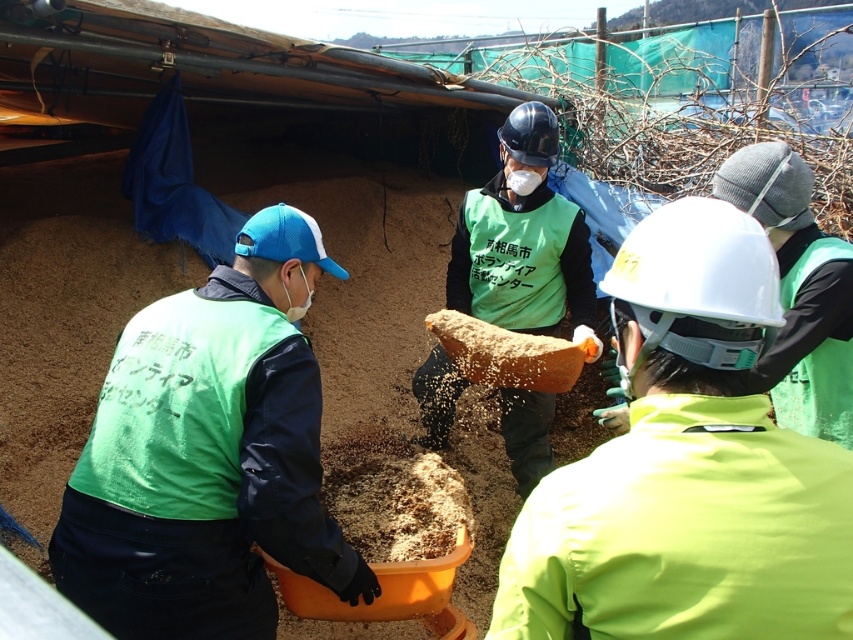
Does green fabric vest at left have a lesser width compared to green fabric vest at center?

In fact, green fabric vest at left might be wider than green fabric vest at center.

Locate an element on the screen. This screenshot has width=853, height=640. green fabric vest at left is located at coordinates (207, 454).

I want to click on green fabric vest at left, so click(207, 454).

Does matte green vest at center appear over green fabric vest at left?

Correct, matte green vest at center is located above green fabric vest at left.

Who is more distant from viewer, [670,465] or [88,532]?

The point [88,532] is more distant.

Locate an element on the screen. This screenshot has height=640, width=853. matte green vest at center is located at coordinates (688, 467).

You are a GUI agent. You are given a task and a screenshot of the screen. Output one action in this format:
    pyautogui.click(x=<x>, y=<y>)
    Task: Click on the matte green vest at center
    The height and width of the screenshot is (640, 853).
    Given the screenshot: What is the action you would take?
    pyautogui.click(x=688, y=467)

What do you see at coordinates (688, 467) in the screenshot? This screenshot has height=640, width=853. I see `matte green vest at center` at bounding box center [688, 467].

At what (x,y) coordinates should I click in order to perform the action: click on matte green vest at center. Please return your answer as a coordinate pair (x, y). The image size is (853, 640). Looking at the image, I should click on 688,467.